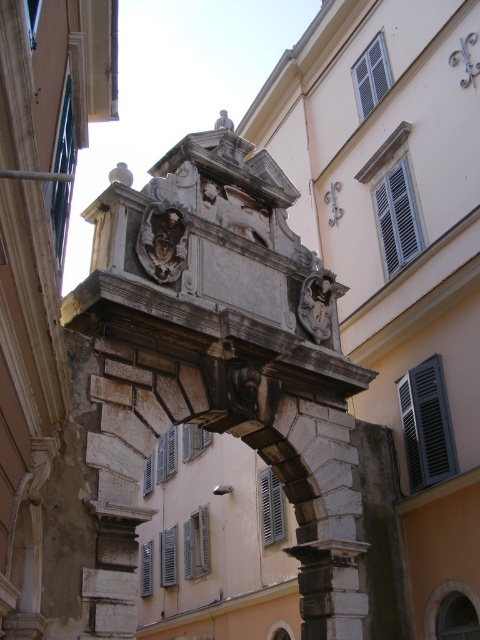
Looking at this image, what is located at the coordinates point (163, 241) in the image of the historic stone archway?

The carved stone mask at center is located at point (163, 241).

You are an architect planning to install a new decorative element between the carved stone mask at center and the stone relief sculpture at center. Given that the element requires 12 meters of space, will there be enough room between them?

The carved stone mask at center and stone relief sculpture at center are 10.54 meters apart, so there is not enough space to install the decorative element requiring 12 meters between them.